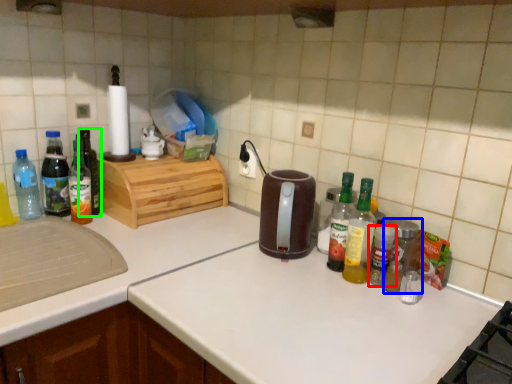
Question: Estimate the real-world distances between objects in this image. Which object is farther from bottle (highlighted by a red box), bottle (highlighted by a blue box) or bottle (highlighted by a green box)?

Choices:
 (A) bottle
 (B) bottle

Answer: (B)